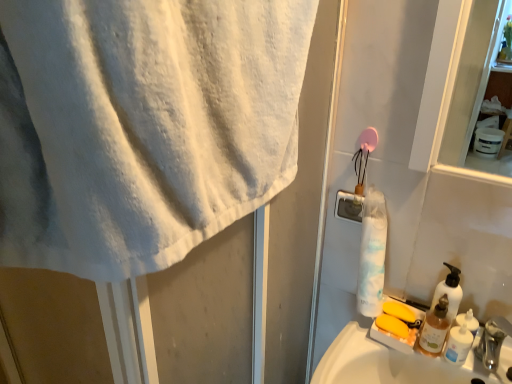
What do you see at coordinates (449, 292) in the screenshot?
I see `white matte soap dispenser at right` at bounding box center [449, 292].

Measure the distance between point (175, 174) and camera.

Point (175, 174) and camera are 48.50 centimeters apart.

Identify the location of silver metallic faucet at lower right. (493, 341).

Measure the distance between point (489, 339) and camera.

Point (489, 339) is 36.26 inches from camera.

Where is `translucent plastic soap dispenser at right`? translucent plastic soap dispenser at right is located at coordinates point(434,328).

Is silver metallic faucet at lower right bigger than white matte soap dispenser at right?

Yes, silver metallic faucet at lower right is bigger than white matte soap dispenser at right.

From a real-world perspective, is silver metallic faucet at lower right over white matte soap dispenser at right?

Incorrect, from a real-world perspective, silver metallic faucet at lower right is lower than white matte soap dispenser at right.

Which object is wider, translucent plastic soap dispenser at right or white cotton towel at upper left?

white cotton towel at upper left.

Is translucent plastic soap dispenser at right positioned far away from white cotton towel at upper left?

No, there isn't a large distance between translucent plastic soap dispenser at right and white cotton towel at upper left.

Does translucent plastic soap dispenser at right contain white cotton towel at upper left?

No, translucent plastic soap dispenser at right does not contain white cotton towel at upper left.

From a real-world perspective, is translucent plastic soap dispenser at right over white cotton towel at upper left?

No, from a real-world perspective, translucent plastic soap dispenser at right is not over white cotton towel at upper left

Is white matte soap dispenser at right facing towards translucent plastic soap dispenser at right?

Yes.

Does white matte soap dispenser at right have a greater height compared to translucent plastic soap dispenser at right?

Yes, white matte soap dispenser at right is taller than translucent plastic soap dispenser at right.

How many degrees apart are the facing directions of white matte soap dispenser at right and translucent plastic soap dispenser at right?

There is a 0.000534-degree angle between the facing directions of white matte soap dispenser at right and translucent plastic soap dispenser at right.

Can you confirm if white matte shaving cream at lower right is bigger than white matte soap dispenser at right?

No.

At what (x,y) coordinates should I click in order to perform the action: click on soap dispenser above the white matte shaving cream at lower right (from the image's perspective). Please return your answer as a coordinate pair (x, y). This screenshot has height=384, width=512. Looking at the image, I should click on pyautogui.click(x=449, y=292).

From the image's perspective, between white matte shaving cream at lower right and white matte soap dispenser at right, which one is located above?

white matte soap dispenser at right is shown above in the image.

Is white matte shaving cream at lower right shorter than white matte soap dispenser at right?

Yes, white matte shaving cream at lower right is shorter than white matte soap dispenser at right.

Is white matte soap dispenser at right in front of white matte shaving cream at lower right?

No, it is not.

Considering the relative sizes of white matte soap dispenser at right and white matte shaving cream at lower right in the image provided, is white matte soap dispenser at right bigger than white matte shaving cream at lower right?

Correct, white matte soap dispenser at right is larger in size than white matte shaving cream at lower right.

Is white matte soap dispenser at right far from white matte shaving cream at lower right?

That's not correct — white matte soap dispenser at right is a little close to white matte shaving cream at lower right.

Is white matte soap dispenser at right positioned with its back to white matte shaving cream at lower right?

white matte soap dispenser at right is not turned away from white matte shaving cream at lower right.

From the image's perspective, which one is positioned lower, white cotton towel at upper left or translucent plastic soap dispenser at right?

From the image's view, translucent plastic soap dispenser at right is below.

Can you confirm if white cotton towel at upper left is shorter than translucent plastic soap dispenser at right?

No, white cotton towel at upper left is not shorter than translucent plastic soap dispenser at right.

Looking at this image, who is smaller, white cotton towel at upper left or translucent plastic soap dispenser at right?

translucent plastic soap dispenser at right.

This screenshot has height=384, width=512. I want to click on towel on the left of translucent plastic soap dispenser at right, so click(x=142, y=126).

How different are the orientations of translucent plastic soap dispenser at right and white matte soap dispenser at right in degrees?

The angle between the facing direction of translucent plastic soap dispenser at right and the facing direction of white matte soap dispenser at right is 0.000534 degrees.

Considering the sizes of translucent plastic soap dispenser at right and white matte soap dispenser at right in the image, is translucent plastic soap dispenser at right wider or thinner than white matte soap dispenser at right?

Clearly, translucent plastic soap dispenser at right has more width compared to white matte soap dispenser at right.

Is translucent plastic soap dispenser at right turned away from white matte soap dispenser at right?

Yes.

Where is `soap dispenser behind the translucent plastic soap dispenser at right`? Image resolution: width=512 pixels, height=384 pixels. soap dispenser behind the translucent plastic soap dispenser at right is located at coordinates (449, 292).

Image resolution: width=512 pixels, height=384 pixels. I want to click on faucet that is in front of the white matte soap dispenser at right, so click(493, 341).

Find the location of a particular element. toiletry beneath the white cotton towel at upper left (from a real-world perspective) is located at coordinates (434, 328).

Which object lies nearer to the anchor point white matte shaving cream at lower right, silver metallic faucet at lower right or white matte soap dispenser at right?

The object closer to white matte shaving cream at lower right is silver metallic faucet at lower right.

From the image, which object appears to be nearer to white cotton towel at upper left, silver metallic faucet at lower right or white matte soap dispenser at right?

Among the two, white matte soap dispenser at right is located nearer to white cotton towel at upper left.

When comparing their distances from white matte shaving cream at lower right, does translucent plastic soap dispenser at right or white matte soap dispenser at right seem further?

The object further to white matte shaving cream at lower right is white matte soap dispenser at right.

Looking at the image, which one is located further to white cotton towel at upper left, silver metallic faucet at lower right or translucent plastic soap dispenser at right?

Based on the image, silver metallic faucet at lower right appears to be further to white cotton towel at upper left.

When comparing their distances from silver metallic faucet at lower right, does white matte soap dispenser at right or translucent plastic soap dispenser at right seem further?

white matte soap dispenser at right is positioned further to the anchor silver metallic faucet at lower right.

Estimate the real-world distances between objects in this image. Which object is closer to silver metallic faucet at lower right, white cotton towel at upper left or white matte shaving cream at lower right?

white matte shaving cream at lower right is closer to silver metallic faucet at lower right.

Considering their positions, is white cotton towel at upper left positioned closer to translucent plastic soap dispenser at right than white matte shaving cream at lower right?

The object closer to translucent plastic soap dispenser at right is white matte shaving cream at lower right.

Estimate the real-world distances between objects in this image. Which object is closer to white matte shaving cream at lower right, white cotton towel at upper left or translucent plastic soap dispenser at right?

translucent plastic soap dispenser at right.

Identify the location of faucet between white cotton towel at upper left and white matte soap dispenser at right along the z-axis. The image size is (512, 384). (493, 341).

Locate an element on the screen. This screenshot has height=384, width=512. shaving cream located between white matte soap dispenser at right and silver metallic faucet at lower right in the left-right direction is located at coordinates (458, 344).

Identify the location of shaving cream between translucent plastic soap dispenser at right and silver metallic faucet at lower right. (458, 344).

Where is `soap dispenser located between translucent plastic soap dispenser at right and silver metallic faucet at lower right in the left-right direction`? The width and height of the screenshot is (512, 384). soap dispenser located between translucent plastic soap dispenser at right and silver metallic faucet at lower right in the left-right direction is located at coordinates (449, 292).